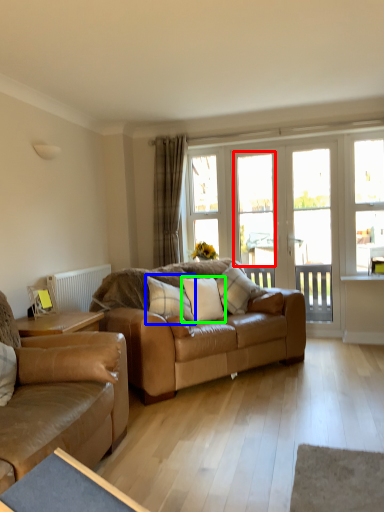
Question: Which is farther away from window (highlighted by a red box)? pillow (highlighted by a blue box) or pillow (highlighted by a green box)?

Choices:
 (A) pillow
 (B) pillow

Answer: (A)